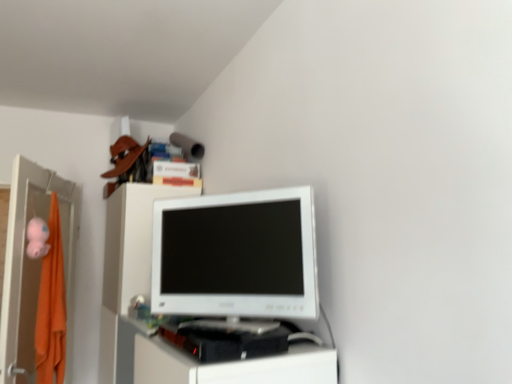
Question: Which is correct: white glossy computer monitor at center is inside orange fabric file cabinet at left, or outside of it?

Choices:
 (A) inside
 (B) outside

Answer: (B)

Question: Considering the positions of point (298, 216) and point (10, 370), is point (298, 216) closer or farther from the camera than point (10, 370)?

Choices:
 (A) farther
 (B) closer

Answer: (B)

Question: Is white glossy computer monitor at center to the left or to the right of orange fabric file cabinet at left in the image?

Choices:
 (A) left
 (B) right

Answer: (B)

Question: From a real-world perspective, relative to white glossy computer monitor at center, is orange fabric file cabinet at left vertically above or below?

Choices:
 (A) below
 (B) above

Answer: (A)

Question: Looking at their shapes, would you say orange fabric file cabinet at left is wider or thinner than white glossy computer monitor at center?

Choices:
 (A) thin
 (B) wide

Answer: (B)

Question: From the image's perspective, is orange fabric file cabinet at left located above or below white glossy computer monitor at center?

Choices:
 (A) above
 (B) below

Answer: (B)

Question: Based on their positions, is orange fabric file cabinet at left located to the left or right of white glossy computer monitor at center?

Choices:
 (A) left
 (B) right

Answer: (A)